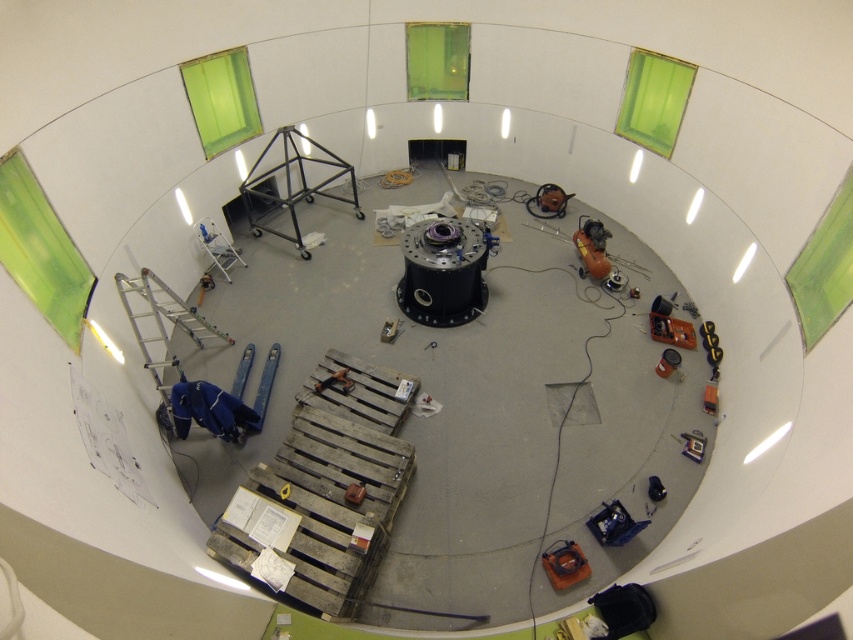
Question: Which point is farther from the camera taking this photo?

Choices:
 (A) (561, 541)
 (B) (223, 237)
 (C) (320, 387)
 (D) (546, 218)

Answer: (D)

Question: Does orange rubber hose at lower right appear over wooden pallet at center?

Choices:
 (A) yes
 (B) no

Answer: (B)

Question: Can you confirm if black matte motor at center is positioned above metallic blue ladder at left?

Choices:
 (A) yes
 (B) no

Answer: (B)

Question: Which object is closer to the camera taking this photo?

Choices:
 (A) metallic robotic arm at right
 (B) wooden pallet at center

Answer: (B)

Question: Is weathered wood pallet at lower left further to the viewer compared to metallic blue ladder at left?

Choices:
 (A) yes
 (B) no

Answer: (B)

Question: Which point is closer to the camera?

Choices:
 (A) coord(206,225)
 (B) coord(561,561)
 (C) coord(535,196)
 (D) coord(347,388)

Answer: (B)